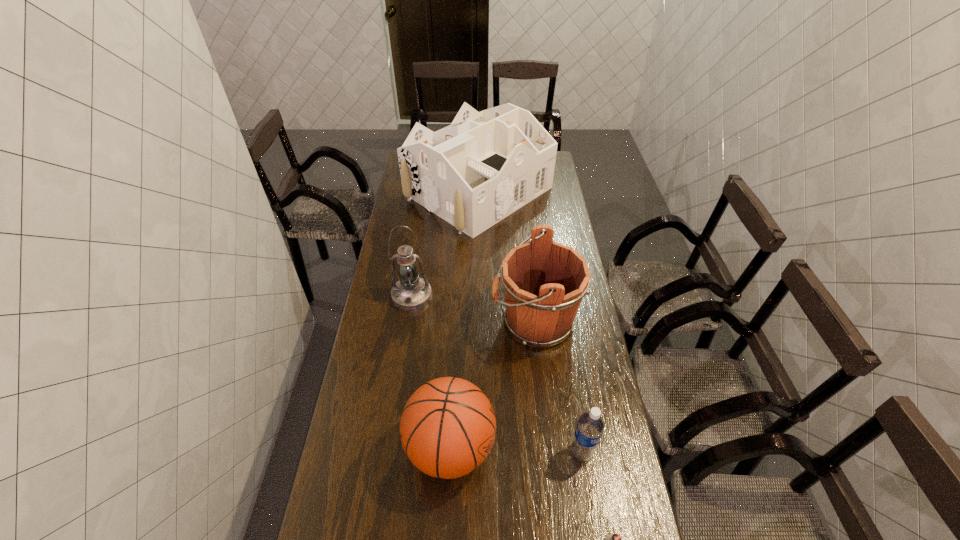
The image size is (960, 540). I want to click on blank space that satisfies the following two spatial constraints: 1. on the front side of the water bottle; 2. on the right side of the basketball, so click(x=450, y=453).